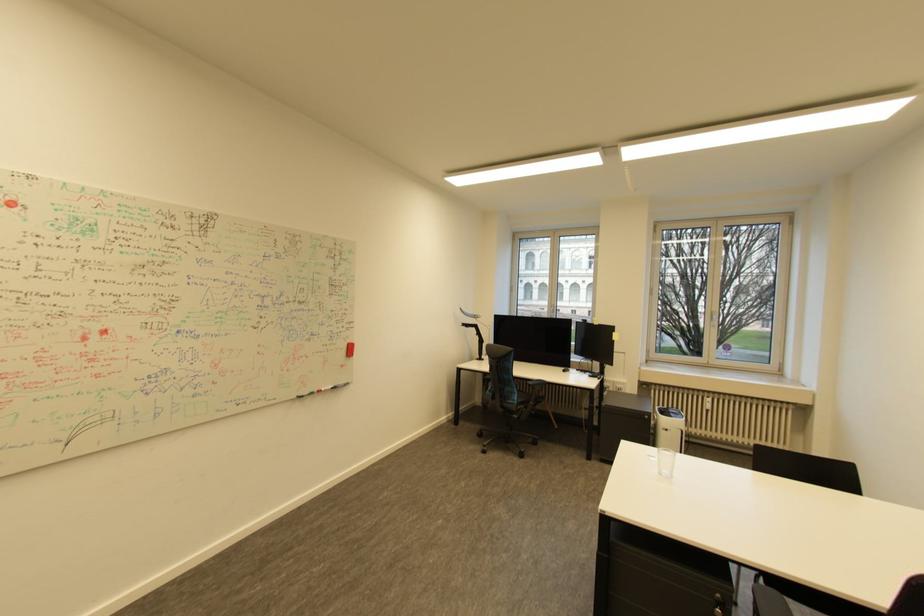
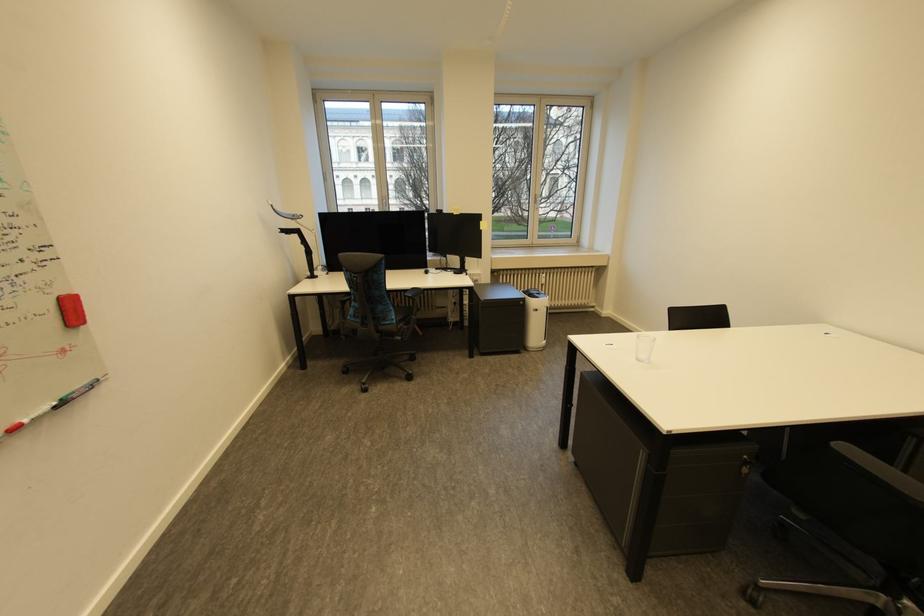
Question: I am providing you with two images of the same scene from different viewpoints. Which of the following objects are not visible in image2?

Choices:
 (A) chair armrest
 (B) chair sitting surface
 (C) white window handle
 (D) none of these

Answer: (D)